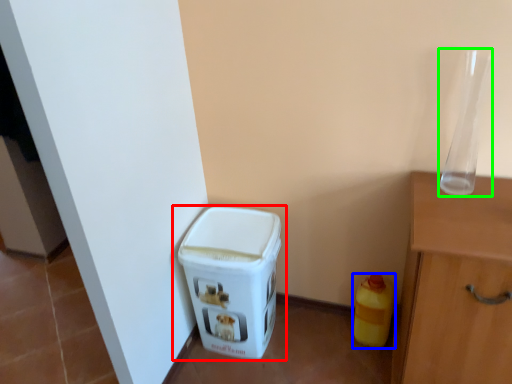
Question: Which is farther away from waste container (highlighted by a red box)? bottle (highlighted by a blue box) or glass vase (highlighted by a green box)?

Choices:
 (A) bottle
 (B) glass vase

Answer: (B)